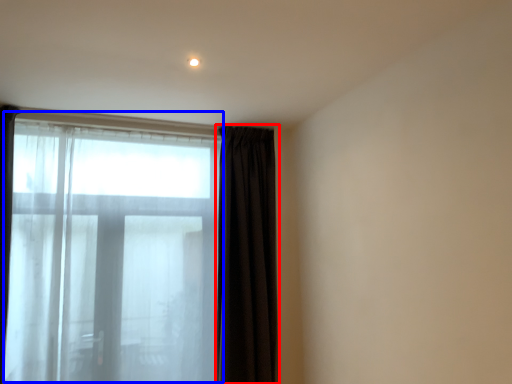
Question: Among these objects, which one is nearest to the camera, curtain (highlighted by a red box) or bay window (highlighted by a blue box)?

Choices:
 (A) curtain
 (B) bay window

Answer: (B)